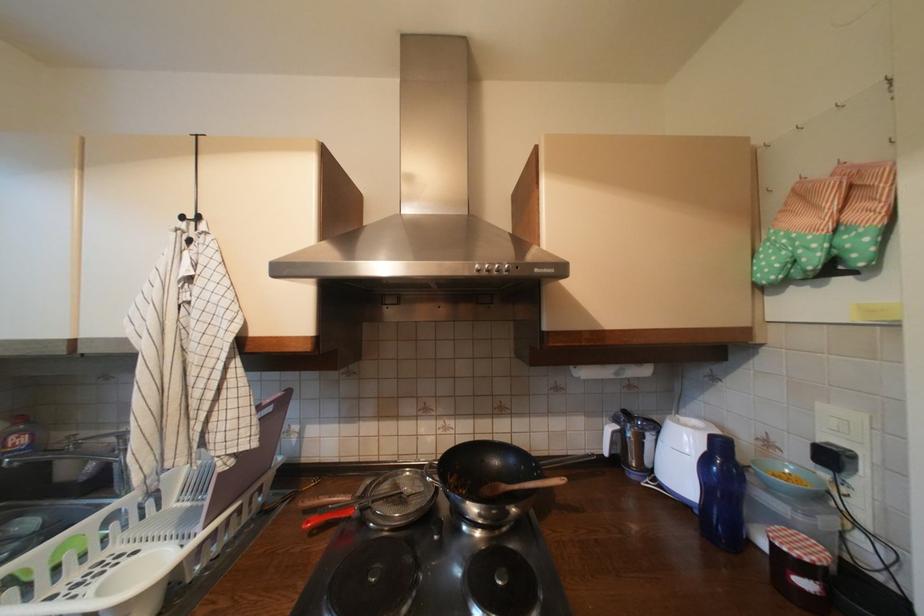
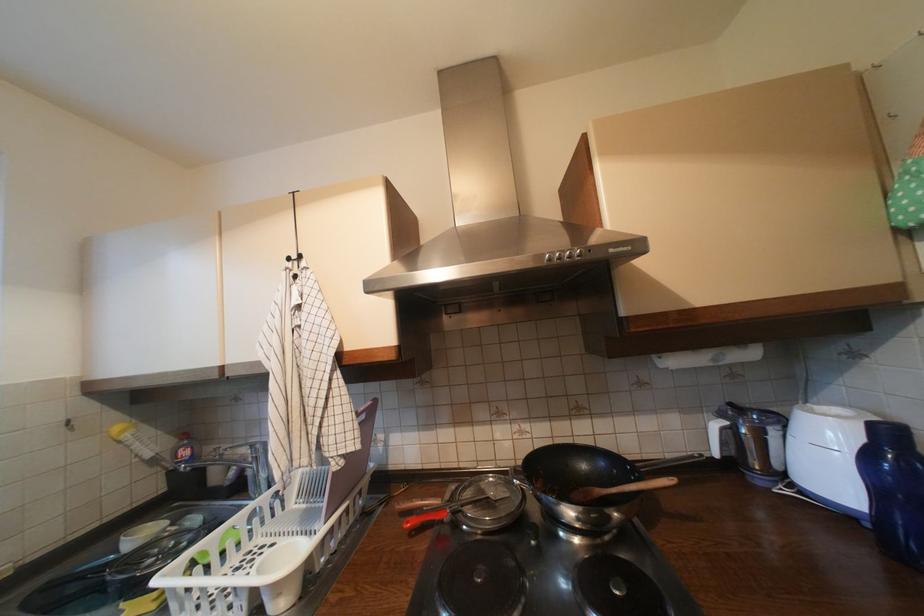
In the second image, find the point that corresponds to pixel 317 524 in the first image.

(417, 524)